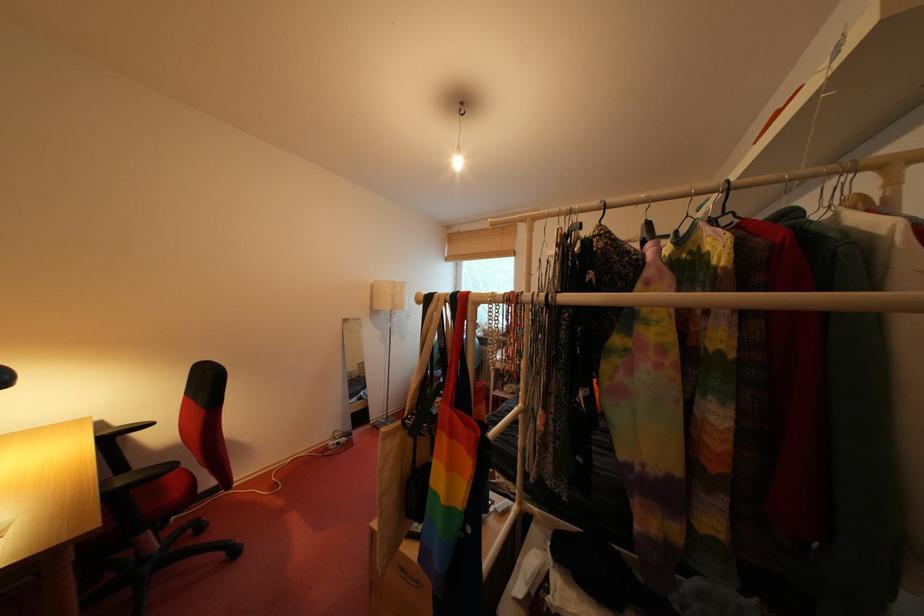
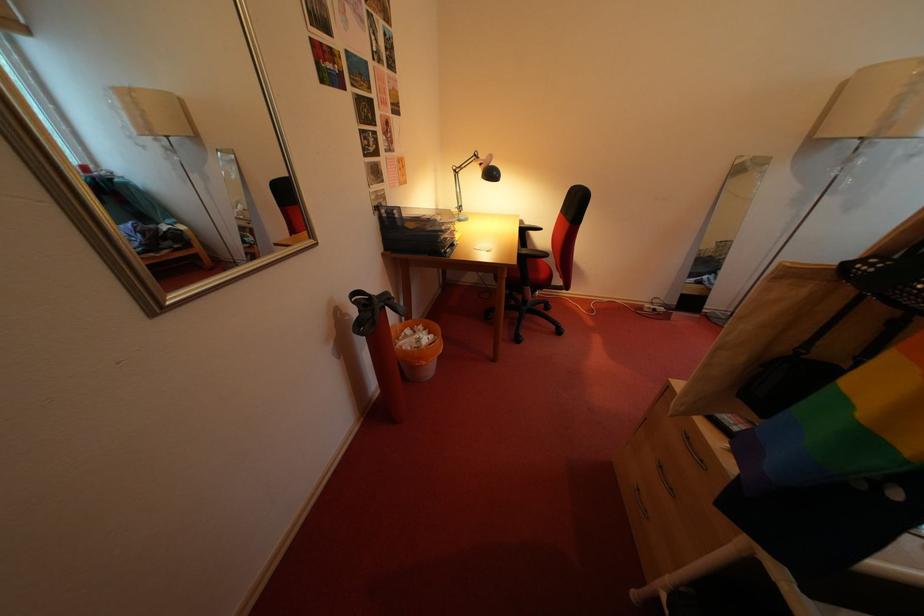
Locate, in the second image, the point that corresponds to point 130,485 in the first image.

(535, 257)